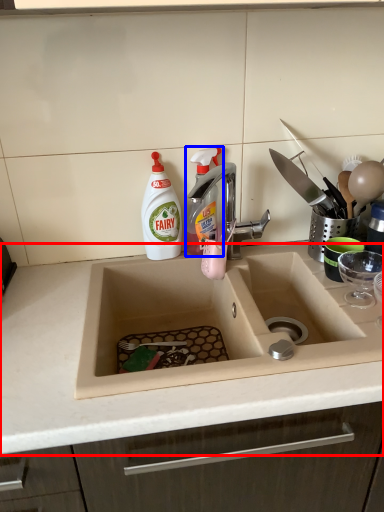
Question: Which point is further to the camera, countertop (highlighted by a red box) or cleaning product (highlighted by a blue box)?

Choices:
 (A) countertop
 (B) cleaning product

Answer: (B)